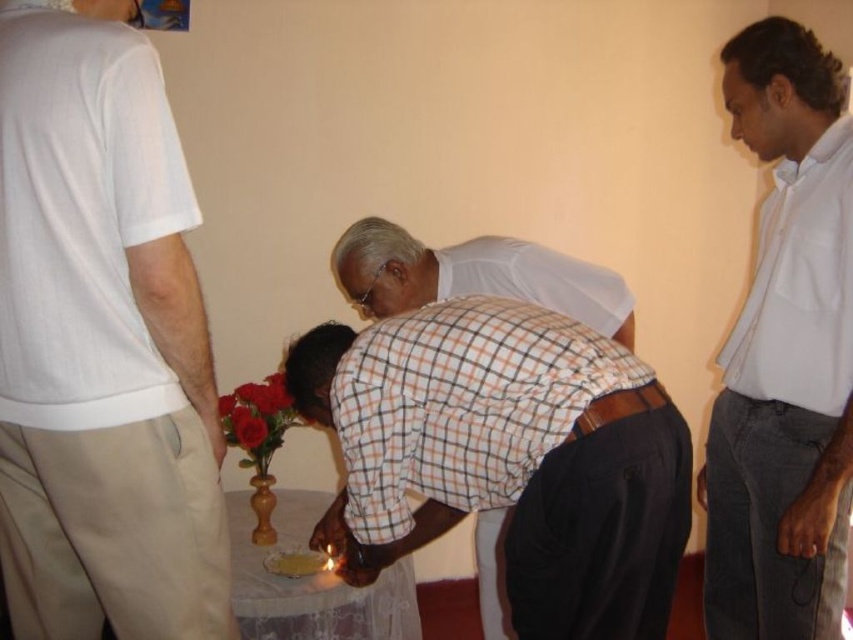
You are a florist who needs to place a bouquet of smooth red roses at center on a smooth white table at center. The table is 32.98 centimeters away from the roses. Can you move the roses to the table without needing to adjust their position?

The smooth white table at center is 32.98 centimeters away from the smooth red roses at center. Since the table and the roses are already positioned at their respective locations, moving the roses to the table would require adjusting their position to cover the 32.98 centimeter distance.

You are an interior designer assessing the spatial arrangement of the room. Considering the objects present, which one is taller between the white cotton shirt at upper left and the smooth red roses at center?

The white cotton shirt at upper left is taller than the smooth red roses at center according to the description provided.

You are a photographer trying to capture a closeup of the smooth red roses at center without including the white cotton shirt at upper left in the frame. Is it possible to do so based on their positions and sizes?

The white cotton shirt at upper left might be wider than smooth red roses at center, so there is a possibility that the white cotton shirt at upper left could block the view of the smooth red roses at center. To ensure the roses are fully visible without the shirt, the photographer should adjust the camera angle or position to avoid the wider shirt obstructing the frame.